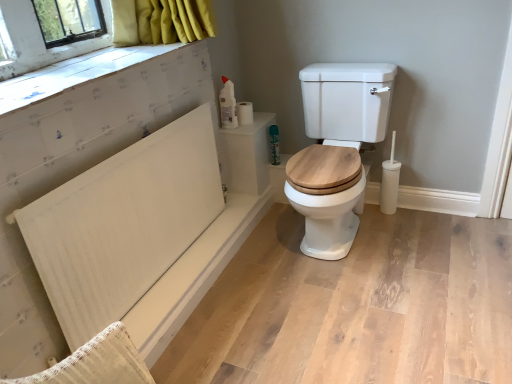
Question: Would you consider green matte spray can at upper right to be distant from white matte bath at lower left?

Choices:
 (A) yes
 (B) no

Answer: (B)

Question: Is green matte spray can at upper right thinner than white matte bath at lower left?

Choices:
 (A) yes
 (B) no

Answer: (B)

Question: Is green matte spray can at upper right smaller than white matte bath at lower left?

Choices:
 (A) no
 (B) yes

Answer: (B)

Question: From a real-world perspective, is green matte spray can at upper right physically below white matte bath at lower left?

Choices:
 (A) yes
 (B) no

Answer: (B)

Question: Is green matte spray can at upper right to the left of white matte bath at lower left from the viewer's perspective?

Choices:
 (A) no
 (B) yes

Answer: (A)

Question: Would you say green matte spray can at upper right contains white matte bath at lower left?

Choices:
 (A) no
 (B) yes

Answer: (A)

Question: Can you confirm if white textured radiator at left is thinner than white matte toilet paper at upper right, the 1th toilet paper viewed from the right?

Choices:
 (A) yes
 (B) no

Answer: (A)

Question: Does white textured radiator at left have a smaller size compared to white matte toilet paper at upper right, which ranks as the second toilet paper in left-to-right order?

Choices:
 (A) yes
 (B) no

Answer: (B)

Question: From a real-world perspective, is white textured radiator at left on top of white matte toilet paper at upper right, which ranks as the second toilet paper in left-to-right order?

Choices:
 (A) no
 (B) yes

Answer: (A)

Question: Is white textured radiator at left to the right of white matte toilet paper at upper right, which ranks as the second toilet paper in left-to-right order, from the viewer's perspective?

Choices:
 (A) yes
 (B) no

Answer: (B)

Question: From a real-world perspective, does white textured radiator at left sit lower than white matte toilet paper at upper right, the 1th toilet paper viewed from the right?

Choices:
 (A) yes
 (B) no

Answer: (A)

Question: Is white textured radiator at left positioned beyond the bounds of white matte toilet paper at upper right, which ranks as the second toilet paper in left-to-right order?

Choices:
 (A) no
 (B) yes

Answer: (B)

Question: Does white matte bath at lower left have a greater width compared to green matte spray can at upper right?

Choices:
 (A) yes
 (B) no

Answer: (B)